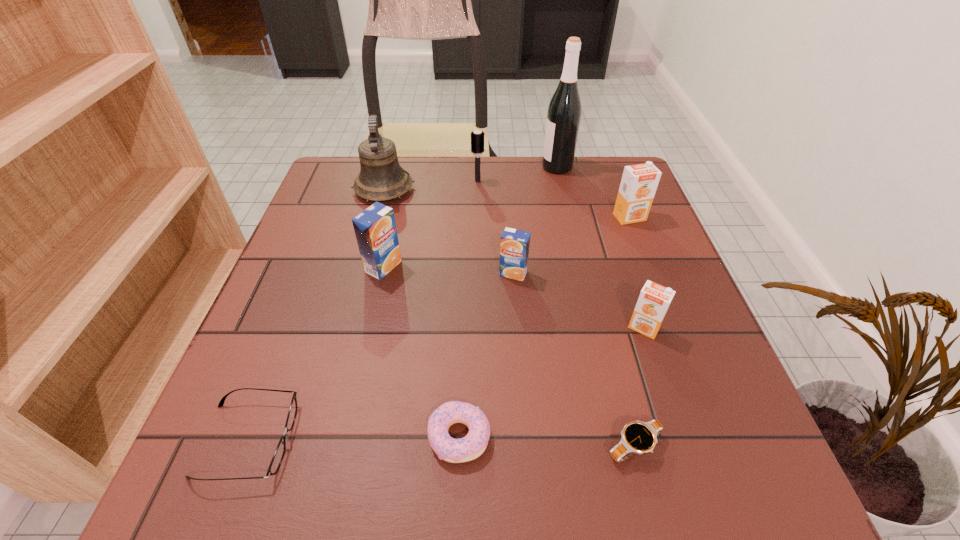
This screenshot has height=540, width=960. What are the coordinates of `the seventh farthest object` in the screenshot? It's located at (654, 299).

Image resolution: width=960 pixels, height=540 pixels. I want to click on the nearest orange juice, so click(654, 299).

The height and width of the screenshot is (540, 960). I want to click on pink doughnut, so click(x=470, y=447).

You are a GUI agent. You are given a task and a screenshot of the screen. Output one action in this format:
    pyautogui.click(x=<x>, y=<y>)
    Task: Click on the spectacles
    The height and width of the screenshot is (540, 960).
    Given the screenshot: What is the action you would take?
    pyautogui.click(x=277, y=458)

In order to click on black watch in this screenshot , I will do `click(638, 437)`.

Where is `vacant space situated 0.320m on the label of the tallest object`? vacant space situated 0.320m on the label of the tallest object is located at coordinates (430, 167).

You are a GUI agent. You are given a task and a screenshot of the screen. Output one action in this format:
    pyautogui.click(x=<x>, y=<y>)
    Task: Click on the free space located on the label of the tallest object
    
    Given the screenshot: What is the action you would take?
    pyautogui.click(x=486, y=167)

In order to click on free space located 0.160m on the label of the tallest object in this screenshot , I will do `click(486, 167)`.

Where is `free region located 0.070m on the right of the bell`? The height and width of the screenshot is (540, 960). free region located 0.070m on the right of the bell is located at coordinates (441, 190).

Where is `free space located 0.050m on the back of the hairbrush`? The height and width of the screenshot is (540, 960). free space located 0.050m on the back of the hairbrush is located at coordinates (478, 168).